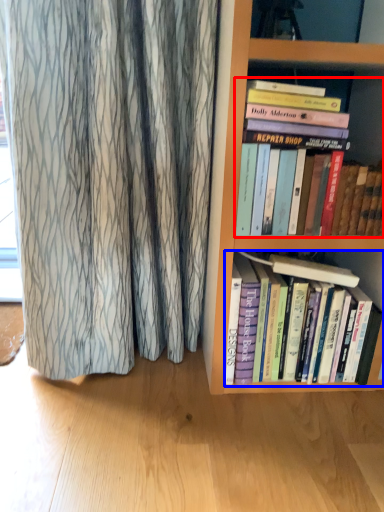
Question: Which object appears closest to the camera in this image, book (highlighted by a red box) or book (highlighted by a blue box)?

Choices:
 (A) book
 (B) book

Answer: (A)